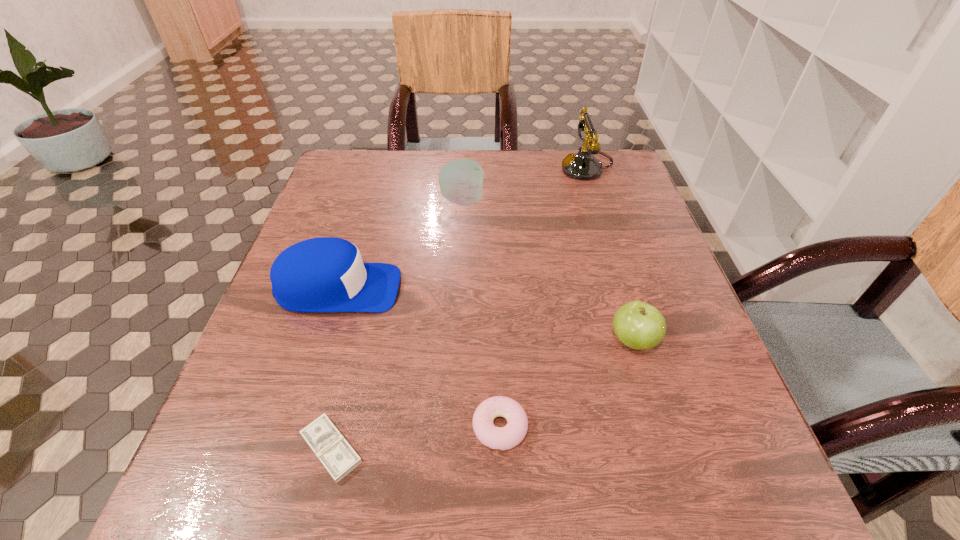
Identify the location of the tallest object. This screenshot has height=540, width=960. (583, 165).

The height and width of the screenshot is (540, 960). What are the coordinates of `the farther apple` in the screenshot? It's located at (461, 181).

The image size is (960, 540). Find the location of `the third farthest object`. the third farthest object is located at coordinates (326, 274).

Where is `the right apple`? This screenshot has width=960, height=540. the right apple is located at coordinates (638, 325).

I want to click on the third nearest object, so click(x=638, y=325).

Find the location of `doughnut`. doughnut is located at coordinates (507, 437).

This screenshot has width=960, height=540. Identify the location of money. (338, 457).

I want to click on free space located on the dial of the telephone, so pyautogui.click(x=431, y=168).

At what (x,y) coordinates should I click in order to perform the action: click on vacant space located 0.320m on the dial of the telephone. Please return your answer as a coordinate pair (x, y). The width and height of the screenshot is (960, 540). Looking at the image, I should click on (445, 168).

I want to click on vacant space located 0.080m on the dial of the telephone, so click(532, 168).